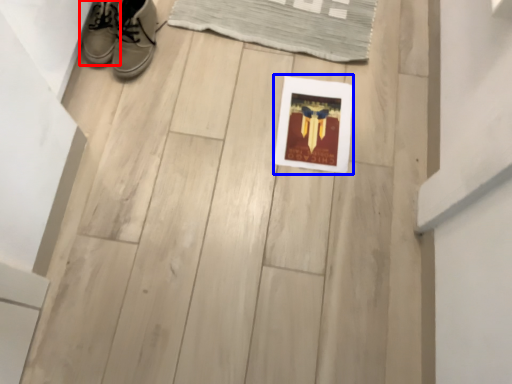
Question: Which object is closer to the camera taking this photo, footwear (highlighted by a red box) or picture frame (highlighted by a blue box)?

Choices:
 (A) footwear
 (B) picture frame

Answer: (A)